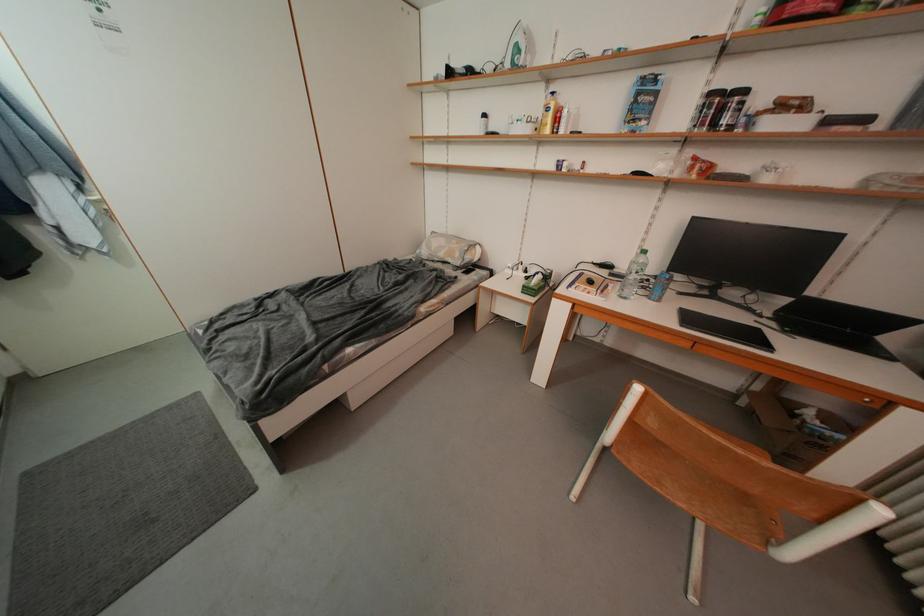
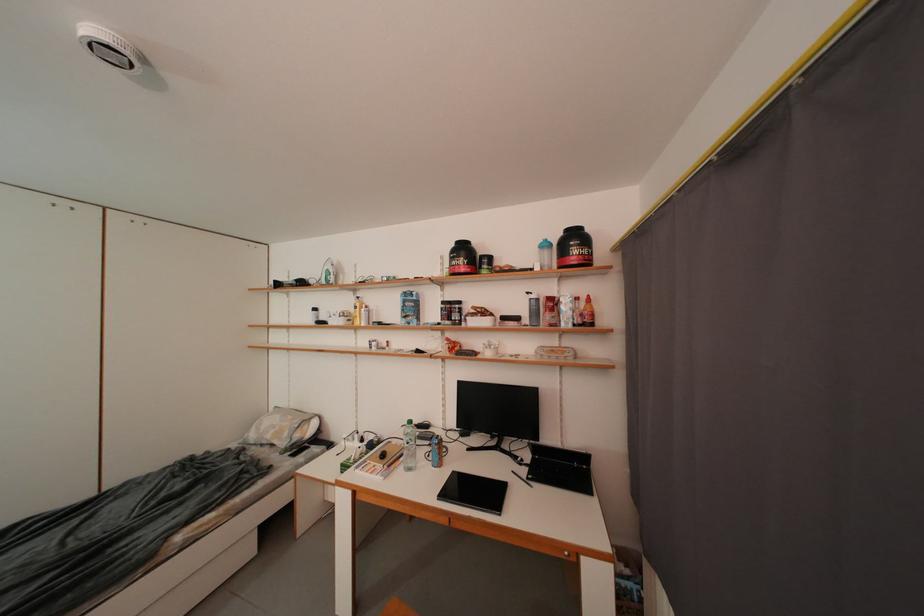
In the second image, find the point that corresponds to point (706, 177) in the first image.

(457, 355)